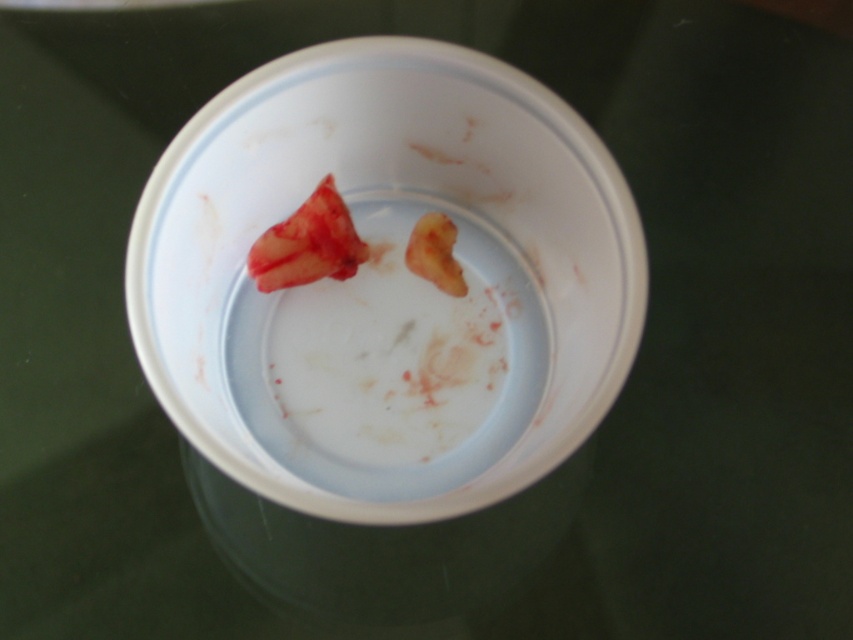
You are a food delivery person who needs to place a white glossy plate at center and meaty red at center on a table. The table has limited space, and you must ensure that the distance between them is at least 8 inches to prevent spills. Based on the image, can you safely place them without violating the spacing requirement?

The white glossy plate at center and meaty red at center are 7.02 inches apart, which is less than the required 8 inches. Therefore, you cannot safely place them without violating the spacing requirement.

You are at a picnic and see a white glossy plate at center and meaty red at center. Which object is closer to you?

The white glossy plate at center is closer to you since it is in front of meaty red at center.

In the scene shown: You are a food inspector checking the cup. You see the meaty red at center and the yellowish matte flesh at center inside the cup. Which part is taller?

The meaty red at center is much taller than the yellowish matte flesh at center.